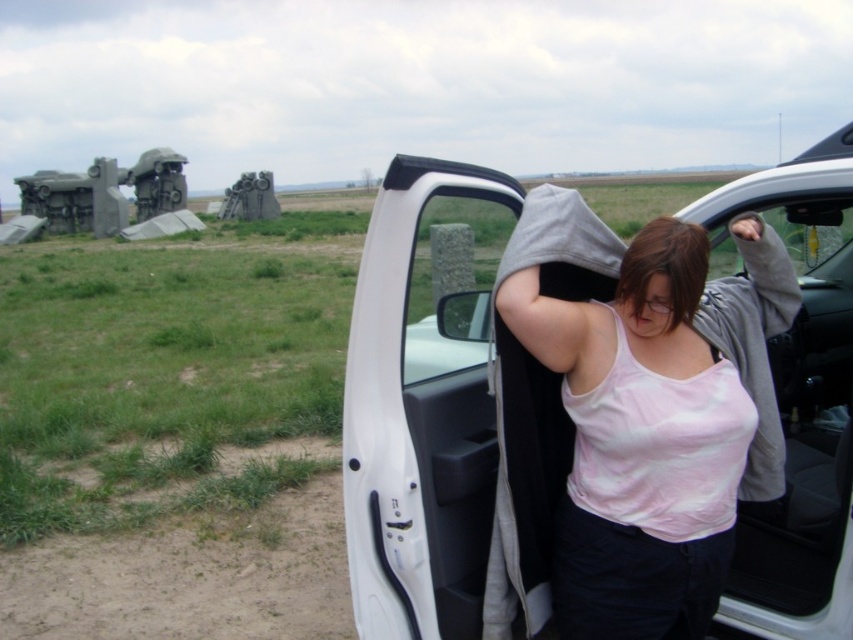
Which is more to the left, white matte car door at center or pink cotton tank top at center?

Positioned to the left is white matte car door at center.

Is point (480, 292) farther from camera compared to point (537, 556)?

Yes, point (480, 292) is farther from viewer.

Who is more forward, (798,365) or (521,243)?

Positioned in front is point (521,243).

Where is `white matte car door at center`? Image resolution: width=853 pixels, height=640 pixels. white matte car door at center is located at coordinates (459, 401).